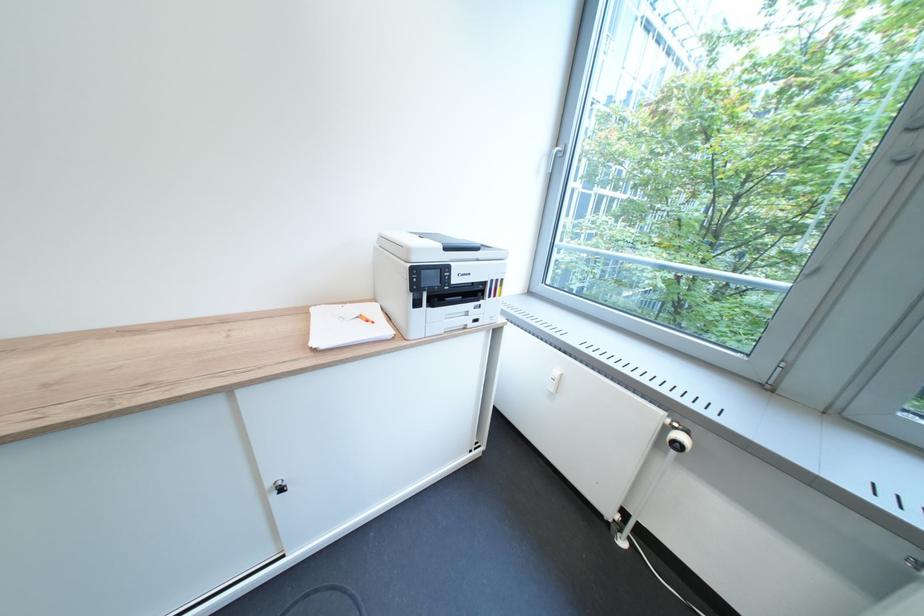
Locate an element on the screen. This screenshot has height=616, width=924. stack of white paper is located at coordinates (346, 325).